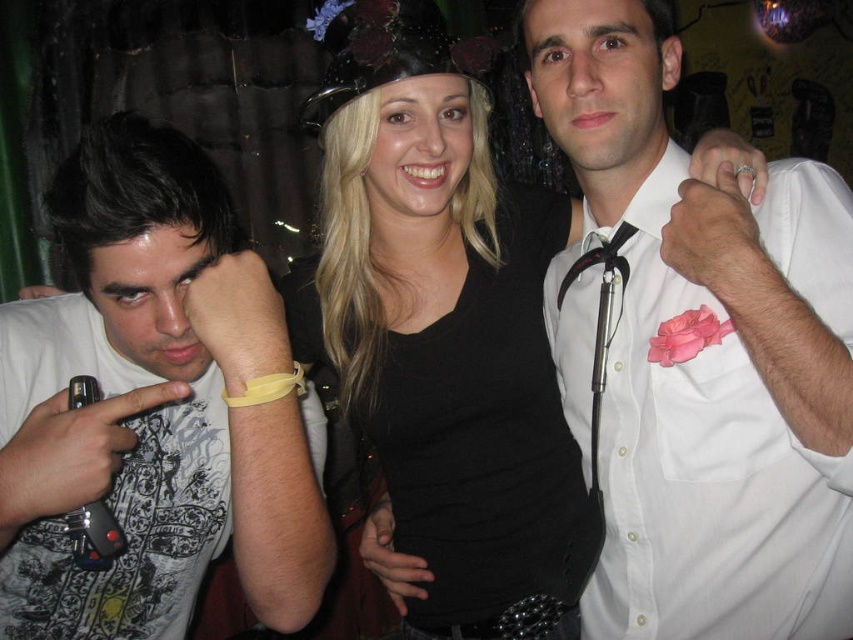
Looking at this image, you are standing in front of the group and want to know which of the two points, point (212,440) or point (380,396), is closer to you. Based on the scene description, which point is nearer?

Point (212,440) is closer to you because it is further to the viewer compared to point (380,396).